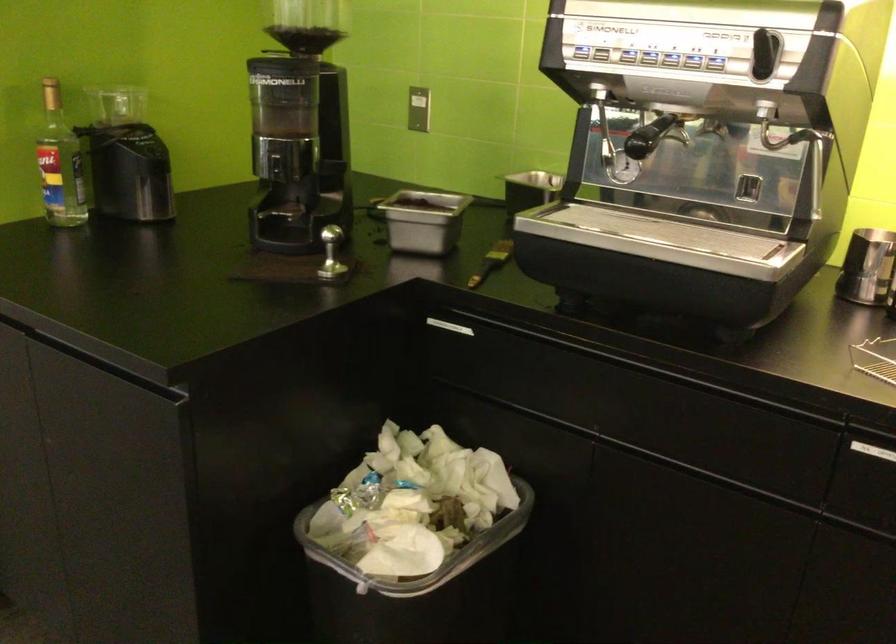
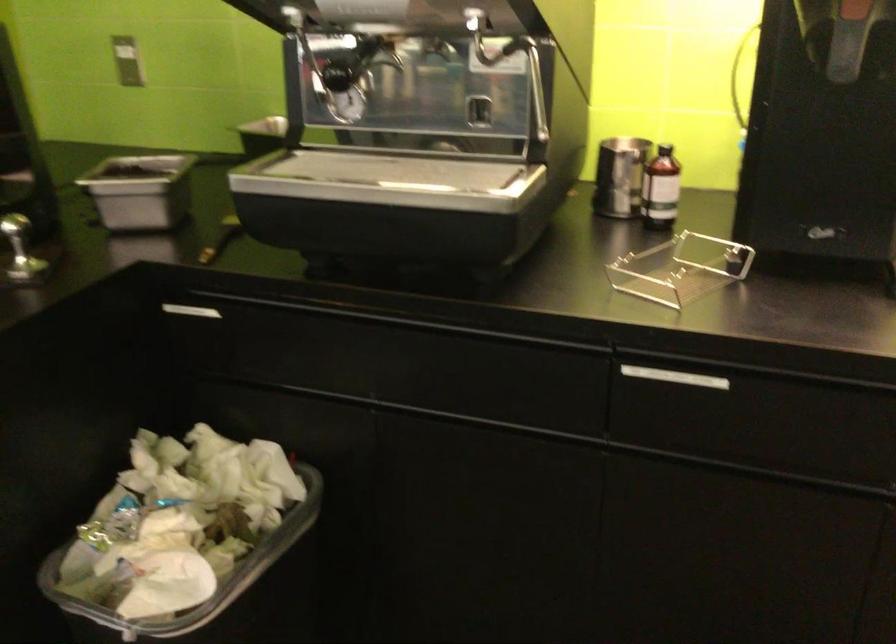
In the second image, find the point that corresponds to (x=787, y=149) in the first image.

(513, 64)